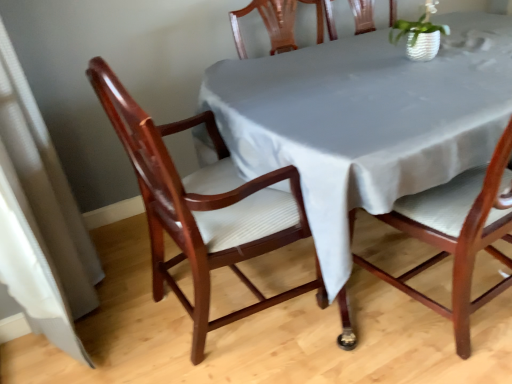
What is the approximate width of smooth gray tablecloth at center?

It is 1.08 meters.

Where is `smooth gray tablecloth at center`? The height and width of the screenshot is (384, 512). smooth gray tablecloth at center is located at coordinates (365, 120).

What do you see at coordinates (417, 26) in the screenshot? Image resolution: width=512 pixels, height=384 pixels. I see `white textured pot at upper right` at bounding box center [417, 26].

You are a GUI agent. You are given a task and a screenshot of the screen. Output one action in this format:
    pyautogui.click(x=<x>, y=<y>)
    Task: Click on the smooth gray tablecloth at center
    This screenshot has height=384, width=512.
    Given the screenshot: What is the action you would take?
    pyautogui.click(x=365, y=120)

Does mahogany wood chair at center, which is the 1th chair in right-to-left order, have a smaller size compared to white textured pot at upper right?

Actually, mahogany wood chair at center, which is the 1th chair in right-to-left order, might be larger than white textured pot at upper right.

From the image's perspective, which is above, mahogany wood chair at center, the second chair when ordered from left to right, or white textured pot at upper right?

From the image's view, white textured pot at upper right is above.

Which is more to the left, mahogany wood chair at center, which is the 1th chair in right-to-left order, or white textured pot at upper right?

Positioned to the left is white textured pot at upper right.

Considering their positions, is mahogany wood chair at center, the second chair when ordered from left to right, located in front of or behind white textured pot at upper right?

Visually, mahogany wood chair at center, the second chair when ordered from left to right, is located in front of white textured pot at upper right.

From the image's perspective, which one is positioned higher, mahogany wood chair at center, which is the 1th chair in right-to-left order, or smooth gray tablecloth at center?

smooth gray tablecloth at center appears higher in the image.

Between mahogany wood chair at center, the second chair when ordered from left to right, and smooth gray tablecloth at center, which one has more height?

Standing taller between the two is mahogany wood chair at center, the second chair when ordered from left to right.

Is smooth gray tablecloth at center at the back of mahogany wood chair at center, the second chair when ordered from left to right?

Yes, mahogany wood chair at center, the second chair when ordered from left to right, is facing away from smooth gray tablecloth at center.

Is mahogany wood chair at center, which is the 1th chair in right-to-left order, not near smooth gray tablecloth at center?

No, mahogany wood chair at center, which is the 1th chair in right-to-left order, is in close proximity to smooth gray tablecloth at center.

Is mahogany wood chair at left, which is the 1th chair from left to right, directly adjacent to white textured pot at upper right?

mahogany wood chair at left, which is the 1th chair from left to right, is not next to white textured pot at upper right, and they're not touching.

Is mahogany wood chair at left, placed as the second chair when sorted from right to left, turned away from white textured pot at upper right?

No, mahogany wood chair at left, placed as the second chair when sorted from right to left,'s orientation is not away from white textured pot at upper right.

At what (x,y) coordinates should I click in order to perform the action: click on plant above the mahogany wood chair at left, placed as the second chair when sorted from right to left (from the image's perspective). Please return your answer as a coordinate pair (x, y). This screenshot has height=384, width=512. Looking at the image, I should click on (417, 26).

Is mahogany wood chair at left, placed as the second chair when sorted from right to left, taller or shorter than white textured pot at upper right?

mahogany wood chair at left, placed as the second chair when sorted from right to left, is taller than white textured pot at upper right.

Can you see mahogany wood chair at center, which is the 1th chair in right-to-left order, touching mahogany wood chair at left, placed as the second chair when sorted from right to left?

No, mahogany wood chair at center, which is the 1th chair in right-to-left order, is not beside mahogany wood chair at left, placed as the second chair when sorted from right to left.

Considering the relative sizes of mahogany wood chair at center, which is the 1th chair in right-to-left order, and mahogany wood chair at left, placed as the second chair when sorted from right to left, in the image provided, is mahogany wood chair at center, which is the 1th chair in right-to-left order, bigger than mahogany wood chair at left, placed as the second chair when sorted from right to left,?

Actually, mahogany wood chair at center, which is the 1th chair in right-to-left order, might be smaller than mahogany wood chair at left, placed as the second chair when sorted from right to left.

I want to click on chair lying on the right of mahogany wood chair at left, which is the 1th chair from left to right, so click(x=458, y=234).

Visually, is mahogany wood chair at center, the second chair when ordered from left to right, positioned to the left or to the right of mahogany wood chair at left, placed as the second chair when sorted from right to left?

Based on their positions, mahogany wood chair at center, the second chair when ordered from left to right, is located to the right of mahogany wood chair at left, placed as the second chair when sorted from right to left.

Which of these two, smooth gray tablecloth at center or mahogany wood chair at left, which is the 1th chair from left to right, stands shorter?

Standing shorter between the two is smooth gray tablecloth at center.

Which of these two, smooth gray tablecloth at center or mahogany wood chair at left, placed as the second chair when sorted from right to left, is thinner?

mahogany wood chair at left, placed as the second chair when sorted from right to left.

Consider the image. Which point is more distant from viewer, (345, 256) or (145, 151)?

The point (145, 151) is more distant.

From a real-world perspective, is smooth gray tablecloth at center located higher than mahogany wood chair at left, placed as the second chair when sorted from right to left?

No, from a real-world perspective, smooth gray tablecloth at center is not above mahogany wood chair at left, placed as the second chair when sorted from right to left.

From the image's perspective, which is above, mahogany wood chair at left, placed as the second chair when sorted from right to left, or mahogany wood chair at center, the second chair when ordered from left to right?

mahogany wood chair at center, the second chair when ordered from left to right.

Is mahogany wood chair at left, placed as the second chair when sorted from right to left, oriented away from mahogany wood chair at center, the second chair when ordered from left to right?

mahogany wood chair at left, placed as the second chair when sorted from right to left, is not turned away from mahogany wood chair at center, the second chair when ordered from left to right.

Are mahogany wood chair at left, which is the 1th chair from left to right, and mahogany wood chair at center, the second chair when ordered from left to right, located far from each other?

That's not correct — mahogany wood chair at left, which is the 1th chair from left to right, is a little close to mahogany wood chair at center, the second chair when ordered from left to right.

In terms of width, does mahogany wood chair at left, placed as the second chair when sorted from right to left, look wider or thinner when compared to mahogany wood chair at center, which is the 1th chair in right-to-left order?

Considering their sizes, mahogany wood chair at left, placed as the second chair when sorted from right to left, looks broader than mahogany wood chair at center, which is the 1th chair in right-to-left order.

Consider the image. Can you tell me how much white textured pot at upper right and smooth gray tablecloth at center differ in facing direction?

white textured pot at upper right and smooth gray tablecloth at center are facing 0.55 degrees away from each other.

Considering the relative sizes of white textured pot at upper right and smooth gray tablecloth at center in the image provided, is white textured pot at upper right wider than smooth gray tablecloth at center?

In fact, white textured pot at upper right might be narrower than smooth gray tablecloth at center.

From a real-world perspective, is white textured pot at upper right below smooth gray tablecloth at center?

No, from a real-world perspective, white textured pot at upper right is not under smooth gray tablecloth at center.

From the image's perspective, which object appears higher, white textured pot at upper right or smooth gray tablecloth at center?

white textured pot at upper right appears higher in the image.

Locate an element on the screen. plant above the mahogany wood chair at center, which is the 1th chair in right-to-left order (from the image's perspective) is located at coordinates tap(417, 26).

Where is `chair that is the 2nd object located in front of the smooth gray tablecloth at center`? This screenshot has width=512, height=384. chair that is the 2nd object located in front of the smooth gray tablecloth at center is located at coordinates (458, 234).

In the scene shown: From the image, which object appears to be farther from smooth gray tablecloth at center, mahogany wood chair at center, which is the 1th chair in right-to-left order, or mahogany wood chair at left, placed as the second chair when sorted from right to left?

mahogany wood chair at center, which is the 1th chair in right-to-left order, is positioned further to the anchor smooth gray tablecloth at center.

From the image, which object appears to be farther from white textured pot at upper right, mahogany wood chair at left, placed as the second chair when sorted from right to left, or smooth gray tablecloth at center?

mahogany wood chair at left, placed as the second chair when sorted from right to left, lies further to white textured pot at upper right than the other object.

Based on their spatial positions, is mahogany wood chair at center, the second chair when ordered from left to right, or mahogany wood chair at left, placed as the second chair when sorted from right to left, further from white textured pot at upper right?

A: mahogany wood chair at left, placed as the second chair when sorted from right to left.

When comparing their distances from smooth gray tablecloth at center, does white textured pot at upper right or mahogany wood chair at left, which is the 1th chair from left to right, seem further?

white textured pot at upper right.

From the image, which object appears to be nearer to mahogany wood chair at center, which is the 1th chair in right-to-left order, white textured pot at upper right or smooth gray tablecloth at center?

smooth gray tablecloth at center is closer to mahogany wood chair at center, which is the 1th chair in right-to-left order.

Considering their positions, is white textured pot at upper right positioned closer to mahogany wood chair at center, the second chair when ordered from left to right, than mahogany wood chair at left, which is the 1th chair from left to right?

mahogany wood chair at left, which is the 1th chair from left to right.

From the image, which object appears to be farther from white textured pot at upper right, mahogany wood chair at left, placed as the second chair when sorted from right to left, or mahogany wood chair at center, the second chair when ordered from left to right?

The object further to white textured pot at upper right is mahogany wood chair at left, placed as the second chair when sorted from right to left.

Based on their spatial positions, is mahogany wood chair at left, which is the 1th chair from left to right, or smooth gray tablecloth at center closer to mahogany wood chair at center, which is the 1th chair in right-to-left order?

smooth gray tablecloth at center lies closer to mahogany wood chair at center, which is the 1th chair in right-to-left order, than the other object.

The image size is (512, 384). Identify the location of table between mahogany wood chair at center, the second chair when ordered from left to right, and white textured pot at upper right from front to back. (365, 120).

This screenshot has width=512, height=384. I want to click on plant located between mahogany wood chair at left, which is the 1th chair from left to right, and mahogany wood chair at center, the second chair when ordered from left to right, in the left-right direction, so click(x=417, y=26).

I want to click on plant located between mahogany wood chair at left, which is the 1th chair from left to right, and smooth gray tablecloth at center in the left-right direction, so (417, 26).

Where is `chair situated between mahogany wood chair at left, which is the 1th chair from left to right, and smooth gray tablecloth at center from left to right`? chair situated between mahogany wood chair at left, which is the 1th chair from left to right, and smooth gray tablecloth at center from left to right is located at coordinates [458, 234].